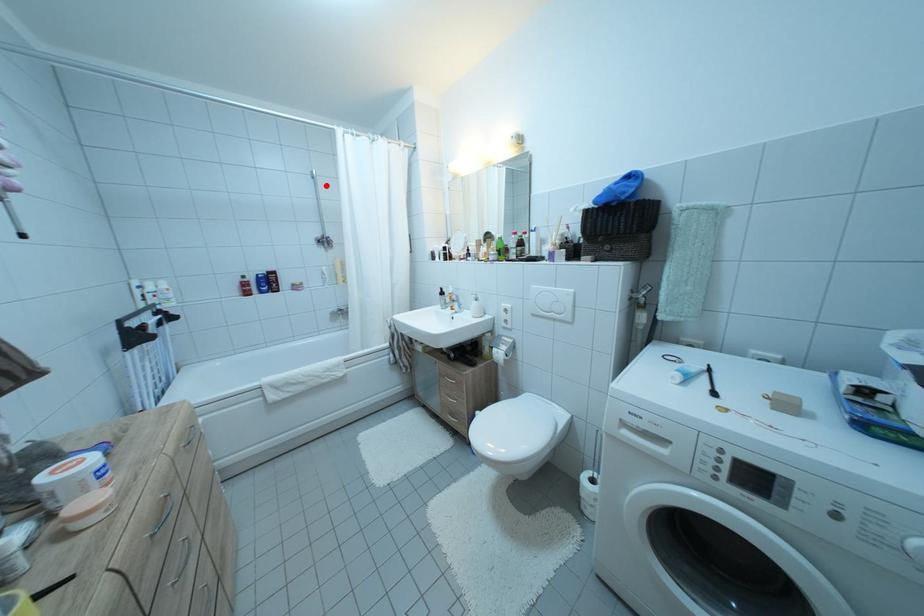
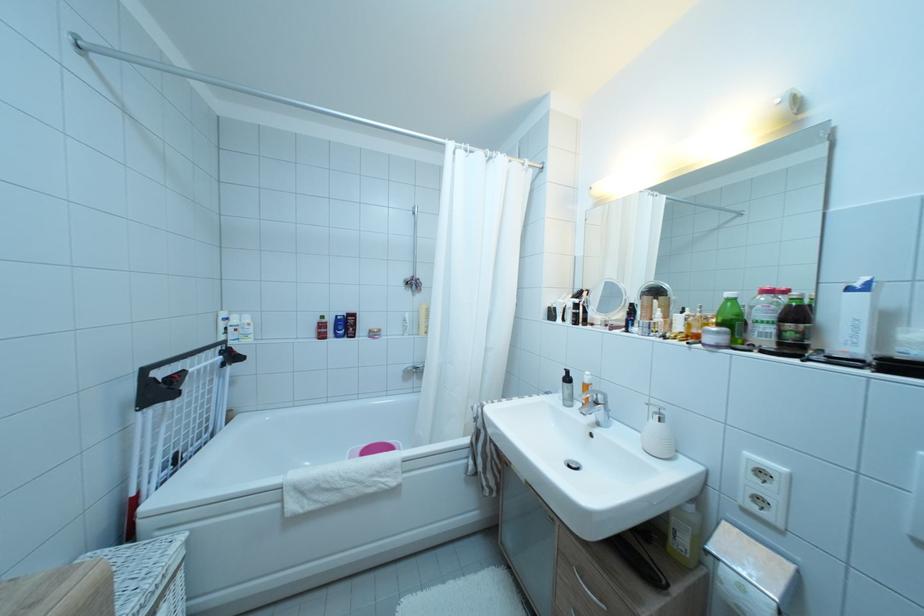
Question: A red point is marked in image1. In image2, is the corresponding 3D point closer to the camera or farther? Reply with the corresponding letter.

Choices:
 (A) The corresponding 3D point is closer.
 (B) The corresponding 3D point is farther.

Answer: (B)